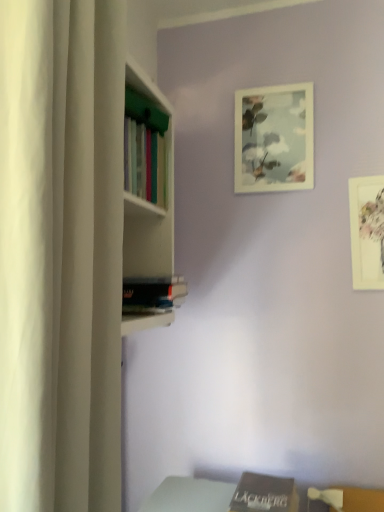
Question: Is white matte curtain at left not inside matte white picture frame at upper center, marked as the 2th picture frame in a bottom-to-top arrangement?

Choices:
 (A) no
 (B) yes

Answer: (B)

Question: Is white matte curtain at left turned away from matte white picture frame at upper center, arranged as the 1th picture frame when viewed from the top?

Choices:
 (A) yes
 (B) no

Answer: (B)

Question: Is white matte curtain at left touching matte white picture frame at upper center, arranged as the 1th picture frame when viewed from the top?

Choices:
 (A) yes
 (B) no

Answer: (B)

Question: From a real-world perspective, does white matte curtain at left stand above matte white picture frame at upper center, positioned as the second picture frame in right-to-left order?

Choices:
 (A) yes
 (B) no

Answer: (B)

Question: Is white matte curtain at left smaller than matte white picture frame at upper center, which is the 1th picture frame from back to front?

Choices:
 (A) yes
 (B) no

Answer: (B)

Question: Does point (243, 482) appear closer or farther from the camera than point (3, 313)?

Choices:
 (A) farther
 (B) closer

Answer: (A)

Question: From a real-world perspective, is brown matte book at lower center, the 1th book from the right, above or below white matte curtain at left?

Choices:
 (A) below
 (B) above

Answer: (A)

Question: Is brown matte book at lower center, the 1th book from the right, inside the boundaries of white matte curtain at left, or outside?

Choices:
 (A) inside
 (B) outside

Answer: (B)

Question: From their relative heights in the image, would you say brown matte book at lower center, the first book when ordered from bottom to top, is taller or shorter than white matte curtain at left?

Choices:
 (A) tall
 (B) short

Answer: (B)

Question: From a real-world perspective, is matte white picture frame at upper center, which is the 1th picture frame from back to front, positioned above or below white matte curtain at left?

Choices:
 (A) below
 (B) above

Answer: (B)

Question: From the image's perspective, is matte white picture frame at upper center, positioned as the second picture frame in right-to-left order, positioned above or below white matte curtain at left?

Choices:
 (A) below
 (B) above

Answer: (B)

Question: In the image, is matte white picture frame at upper center, arranged as the second picture frame when viewed from the front, positioned in front of or behind white matte curtain at left?

Choices:
 (A) behind
 (B) front

Answer: (A)

Question: Looking at their shapes, would you say matte white picture frame at upper center, positioned as the second picture frame in right-to-left order, is wider or thinner than white matte curtain at left?

Choices:
 (A) thin
 (B) wide

Answer: (A)

Question: Considering the positions of white matte curtain at left and matte white picture frame at upper center, positioned as the second picture frame in right-to-left order, in the image, is white matte curtain at left taller or shorter than matte white picture frame at upper center, positioned as the second picture frame in right-to-left order,?

Choices:
 (A) tall
 (B) short

Answer: (A)

Question: In terms of width, does white matte curtain at left look wider or thinner when compared to matte white picture frame at upper center, marked as the 2th picture frame in a bottom-to-top arrangement?

Choices:
 (A) wide
 (B) thin

Answer: (A)